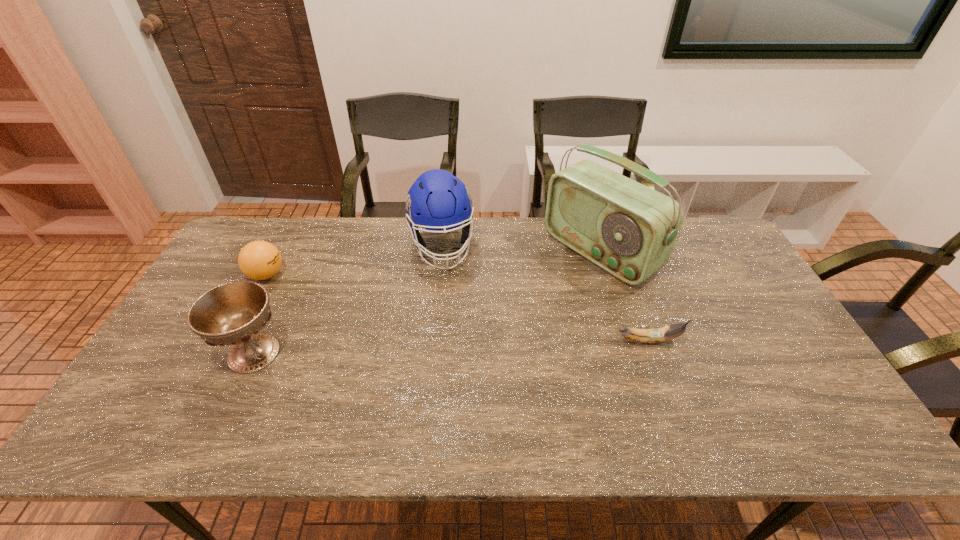
Identify the location of blank region between the shortest object and the radio receiver. This screenshot has width=960, height=540. (624, 296).

Identify the location of free space between the third tallest object and the second tallest object. The image size is (960, 540). (348, 299).

Where is `vacant region between the second shortest object and the shortest object`? The width and height of the screenshot is (960, 540). vacant region between the second shortest object and the shortest object is located at coordinates (458, 308).

Locate an element on the screen. The width and height of the screenshot is (960, 540). vacant region between the ping-pong ball and the third object from left to right is located at coordinates (354, 260).

Locate an element on the screen. This screenshot has width=960, height=540. free space between the tallest object and the third shortest object is located at coordinates (427, 303).

Where is `empty space between the fourth tallest object and the shortest object`? The image size is (960, 540). empty space between the fourth tallest object and the shortest object is located at coordinates click(458, 308).

You are a GUI agent. You are given a task and a screenshot of the screen. Output one action in this format:
    pyautogui.click(x=<x>, y=<y>)
    Task: Click on the vacant space that's between the radio receiver and the football helmet
    
    Given the screenshot: What is the action you would take?
    521,249

Locate an element on the screen. The image size is (960, 540). object that is the fourth closest to the banana is located at coordinates (259, 260).

At what (x,y) coordinates should I click in order to perform the action: click on object that can be found as the third closest to the second shortest object. Please return your answer as a coordinate pair (x, y). The height and width of the screenshot is (540, 960). Looking at the image, I should click on (628, 229).

Where is `free point that satisfies the following two spatial constraints: 1. on the back side of the third object from right to left; 2. on the left side of the chalice`? free point that satisfies the following two spatial constraints: 1. on the back side of the third object from right to left; 2. on the left side of the chalice is located at coordinates (303, 246).